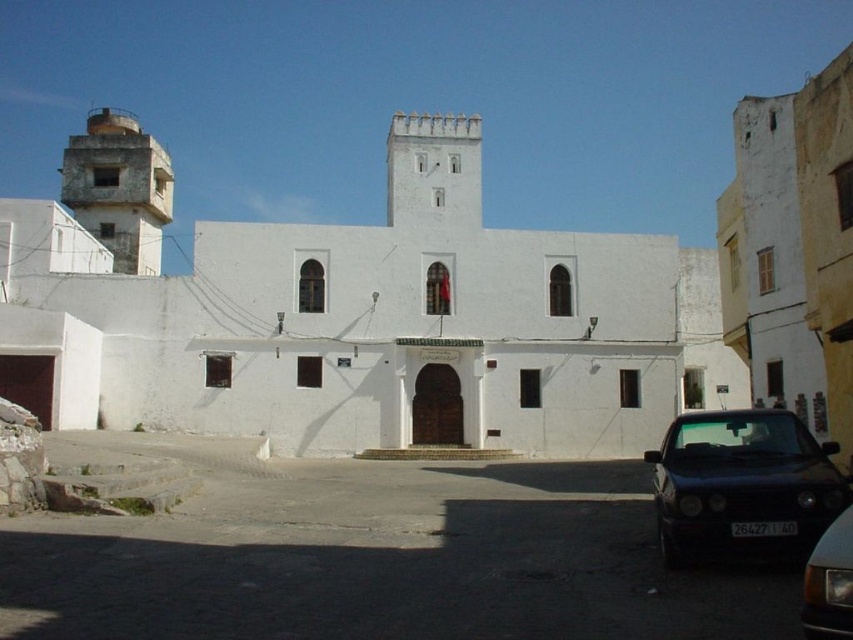
Question: Does black glossy car at lower right come in front of shiny black car at lower right?

Choices:
 (A) no
 (B) yes

Answer: (A)

Question: Is black glossy car at lower right in front of concrete tower at upper left?

Choices:
 (A) yes
 (B) no

Answer: (A)

Question: Which point is closer to the camera taking this photo?

Choices:
 (A) (119, 164)
 (B) (840, 490)
 (C) (450, 237)

Answer: (B)

Question: Which of these objects is positioned closest to the black glossy car at lower right?

Choices:
 (A) concrete tower at upper left
 (B) shiny black car at lower right

Answer: (B)

Question: Does black glossy car at lower right appear on the left side of shiny black car at lower right?

Choices:
 (A) yes
 (B) no

Answer: (B)

Question: Estimate the real-world distances between objects in this image. Which object is closer to the concrete tower at upper left?

Choices:
 (A) black glossy car at lower right
 (B) white matte building at center
 (C) shiny black car at lower right

Answer: (B)